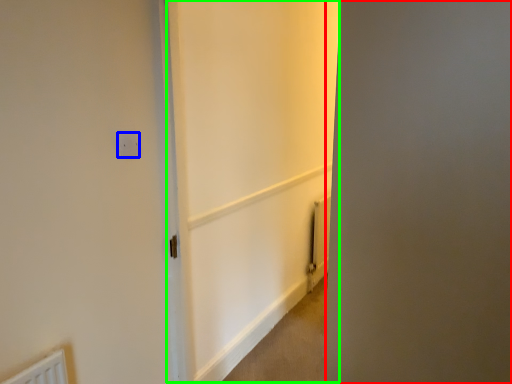
Question: Which is farther away from screen door (highlighted by a red box)? electric outlet (highlighted by a blue box) or screen door (highlighted by a green box)?

Choices:
 (A) electric outlet
 (B) screen door

Answer: (B)